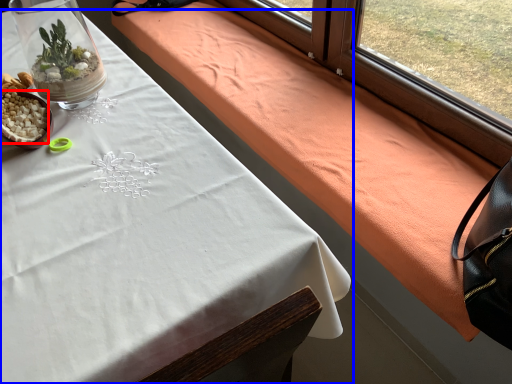
Question: Which point is further to the camera, food (highlighted by a red box) or table (highlighted by a blue box)?

Choices:
 (A) food
 (B) table

Answer: (A)